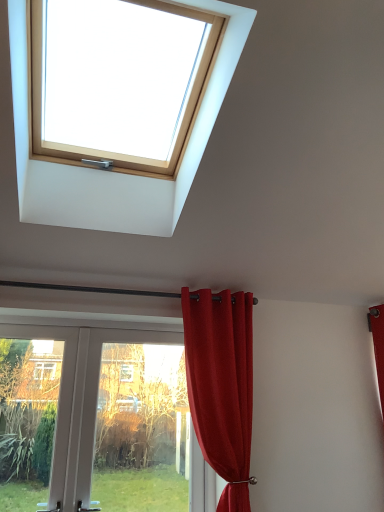
Question: Is white plastic door at lower left spatially inside transparent glass door at lower left, or outside of it?

Choices:
 (A) inside
 (B) outside

Answer: (A)

Question: In terms of size, does white plastic door at lower left appear bigger or smaller than transparent glass door at lower left?

Choices:
 (A) big
 (B) small

Answer: (A)

Question: Estimate the real-world distances between objects in this image. Which object is closer to the transparent glass door at lower left?

Choices:
 (A) wooden skylight at upper center
 (B) satin red curtain at upper center
 (C) white plastic door at lower left

Answer: (C)

Question: Estimate the real-world distances between objects in this image. Which object is farther from the wooden skylight at upper center?

Choices:
 (A) satin red curtain at upper center
 (B) white plastic door at lower left
 (C) transparent glass door at lower left

Answer: (C)